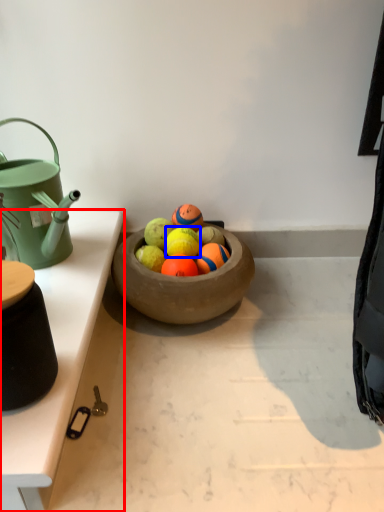
Question: Which of the following is the closest to the observer, table (highlighted by a red box) or fruit (highlighted by a blue box)?

Choices:
 (A) table
 (B) fruit

Answer: (A)